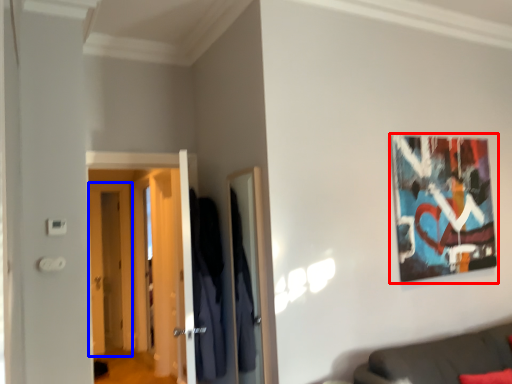
Question: Which of the following is the farthest to the observer, picture frame (highlighted by a red box) or door (highlighted by a blue box)?

Choices:
 (A) picture frame
 (B) door

Answer: (B)